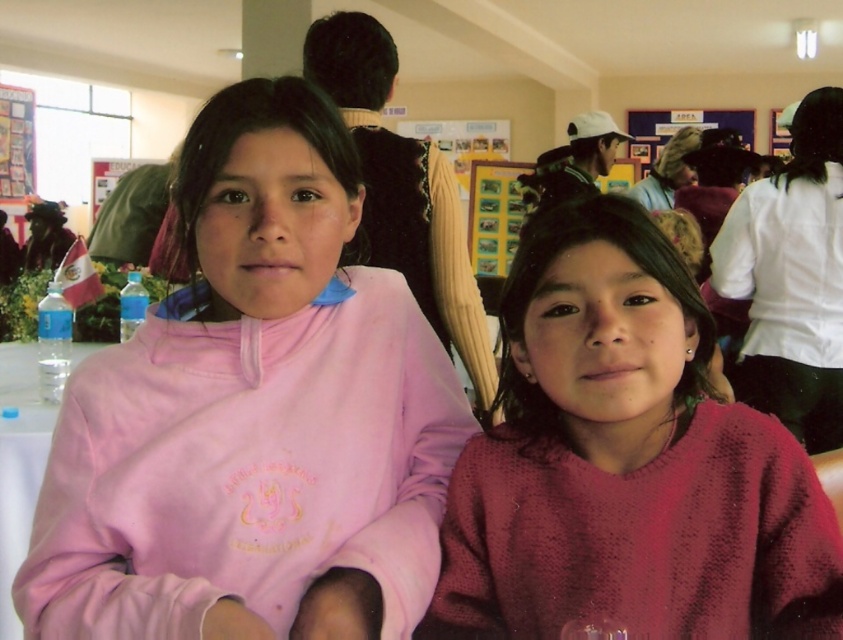
You are a photographer trying to capture both the pink fleece jacket at center and the knitted maroon sweater at center in a single shot. Since they are at the center, you want to ensure they are both in focus. Based on their positions, which one is closer to the camera?

The pink fleece jacket at center is located above the knitted maroon sweater at center, so it is closer to the camera.